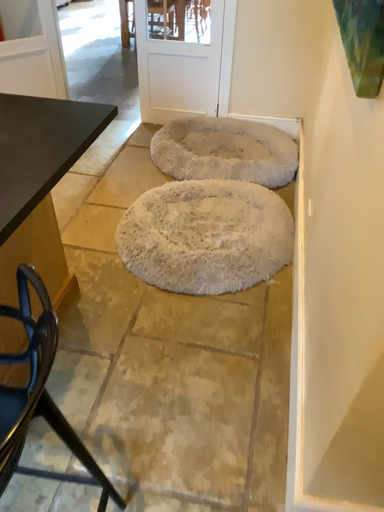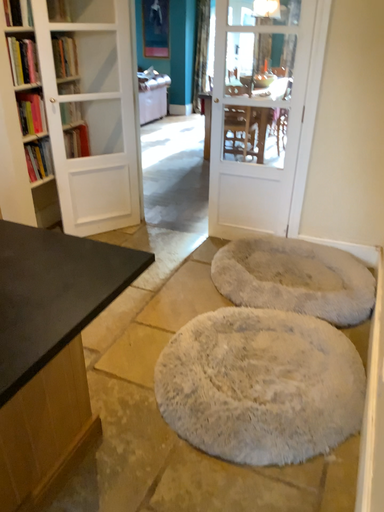
Question: Which way did the camera rotate in the video?

Choices:
 (A) rotated left
 (B) rotated right

Answer: (A)